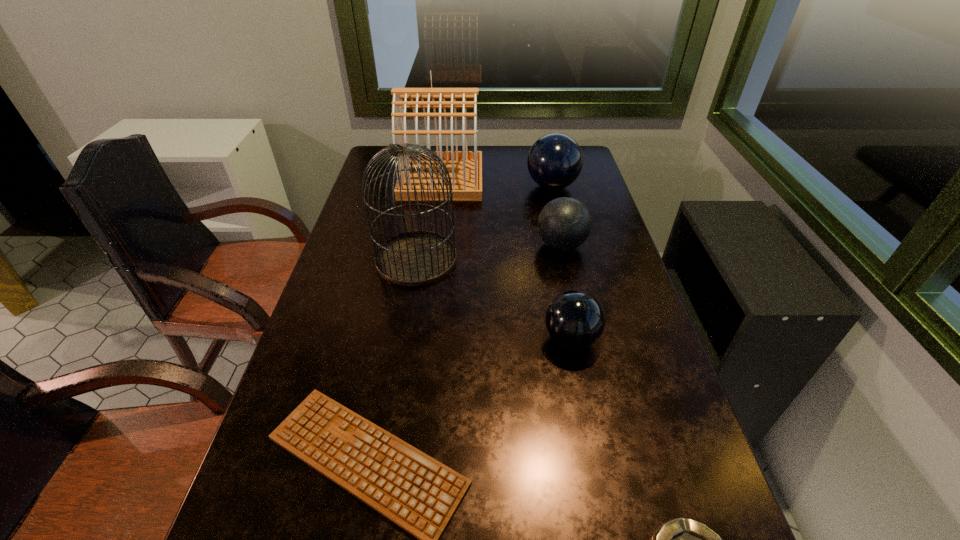
Locate an element on the screen. object present at the far right corner is located at coordinates (555, 160).

In the image, there is a desktop. At what (x,y) coordinates should I click in order to perform the action: click on vacant space at the left edge. Please return your answer as a coordinate pair (x, y). Looking at the image, I should click on (350, 230).

You are a GUI agent. You are given a task and a screenshot of the screen. Output one action in this format:
    pyautogui.click(x=<x>, y=<y>)
    Task: Click on the vacant space at the right edge
    The image size is (960, 540).
    Given the screenshot: What is the action you would take?
    pyautogui.click(x=605, y=242)

The height and width of the screenshot is (540, 960). Find the location of `blank region between the farther birdcage and the nearer birdcage`. blank region between the farther birdcage and the nearer birdcage is located at coordinates (429, 219).

Locate an element on the screen. Image resolution: width=960 pixels, height=540 pixels. vacant space that's between the nearer birdcage and the second farthest bowling ball is located at coordinates (489, 252).

Identify the location of vacant point located between the farther birdcage and the nearest bowling ball. This screenshot has height=540, width=960. [506, 259].

Locate which object ranks fourth in proximity to the second farthest bowling ball. Please provide its 2D coordinates. Your answer should be formatted as a tuple, i.e. [(x, y)], where the tuple contains the x and y coordinates of a point satisfying the conditions above.

[(414, 258)]

Locate which object ranks in proximity to the second nearest bowling ball. Please provide its 2D coordinates. Your answer should be formatted as a tuple, i.e. [(x, y)], where the tuple contains the x and y coordinates of a point satisfying the conditions above.

[(555, 160)]

Identify the location of bowling ball object that ranks as the closest to the ashtray. (575, 320).

Locate an element on the screen. the closest bowling ball to the tallest bowling ball is located at coordinates (564, 223).